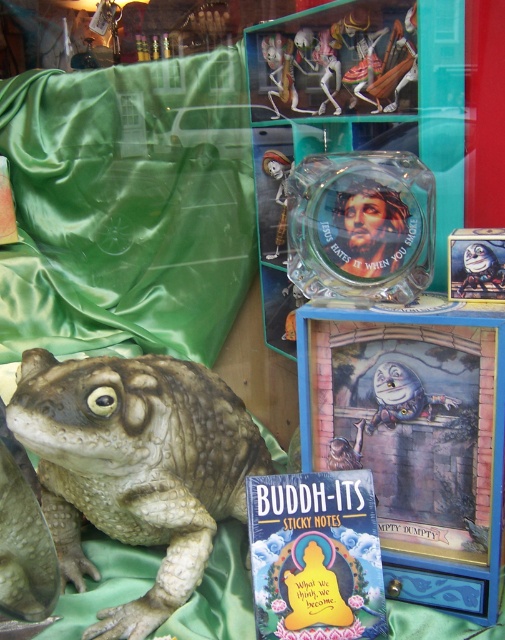
You are standing in front of a display window and see a leather like brown frog at lower left and a small blue box with Alice in Wonderland illustration on the right. Which object is closer to the point at coordinates (135, 467)?

The leather like brown frog at lower left is located at point (135, 467), so it is exactly at that coordinate point.

Consider the image. You are standing in front of the display window and want to touch the point at coordinates point (225, 392). If your hand can reach up to 1.2 meters, will you be able to reach it?

The distance of point (225, 392) from the camera is 1.18 meters, so yes, you can reach it since your hand can extend up to 1.2 meters.